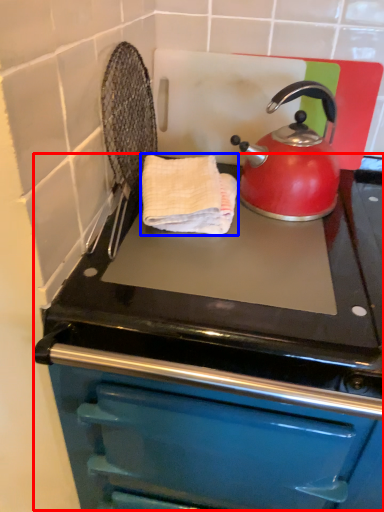
Question: Among these objects, which one is farthest to the camera, oven (highlighted by a red box) or hand towel (highlighted by a blue box)?

Choices:
 (A) oven
 (B) hand towel

Answer: (B)